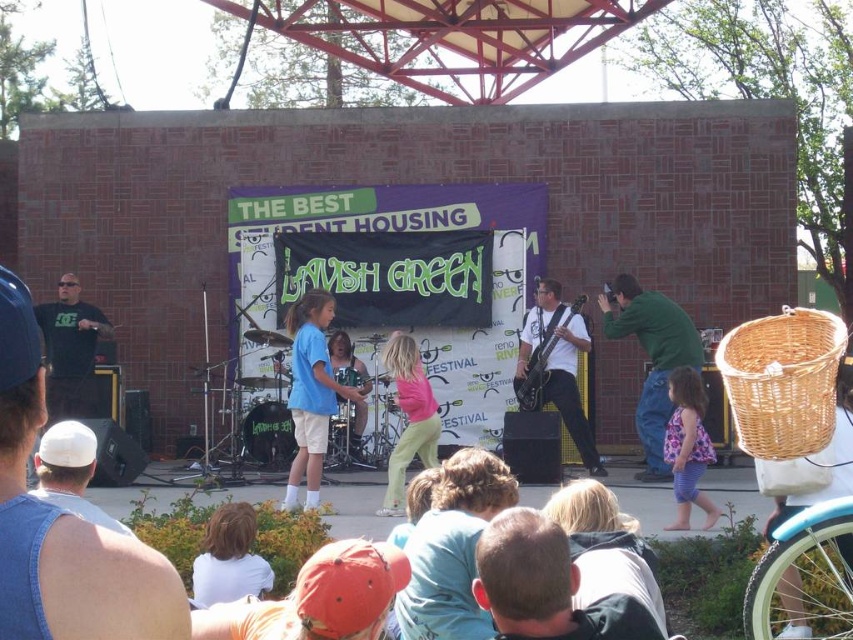
Between point (643, 456) and point (305, 320), which one is positioned in front?

Positioned in front is point (305, 320).

Is green cotton shirt at right thinner than light blue t-shirt at center?

Incorrect, green cotton shirt at right's width is not less than light blue t-shirt at center's.

Between point (648, 340) and point (305, 349), which one is positioned behind?

The point (648, 340) is behind.

Image resolution: width=853 pixels, height=640 pixels. Find the location of `green cotton shirt at right`. green cotton shirt at right is located at coordinates (651, 358).

Is green cotton shirt at right shorter than matte pink shirt at center?

No.

From the picture: Between green cotton shirt at right and matte pink shirt at center, which one has more height?

green cotton shirt at right

Which is in front, point (672, 330) or point (386, 515)?

Positioned in front is point (386, 515).

This screenshot has height=640, width=853. I want to click on green cotton shirt at right, so click(651, 358).

Is white fabric shirt at lower left positioned at the back of purple striped shorts at lower right?

No, white fabric shirt at lower left is closer to the viewer.

Where is `white fabric shirt at lower left`? Image resolution: width=853 pixels, height=640 pixels. white fabric shirt at lower left is located at coordinates (229, 557).

Between point (206, 548) and point (689, 401), which one is positioned in front?

Point (206, 548)

Where is `white fabric shirt at lower left`? This screenshot has width=853, height=640. white fabric shirt at lower left is located at coordinates (229, 557).